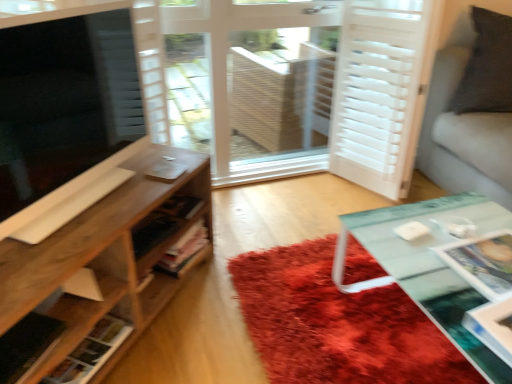
Locate an element on the screen. The width and height of the screenshot is (512, 384). free space behind shaggy red rug at center is located at coordinates (311, 203).